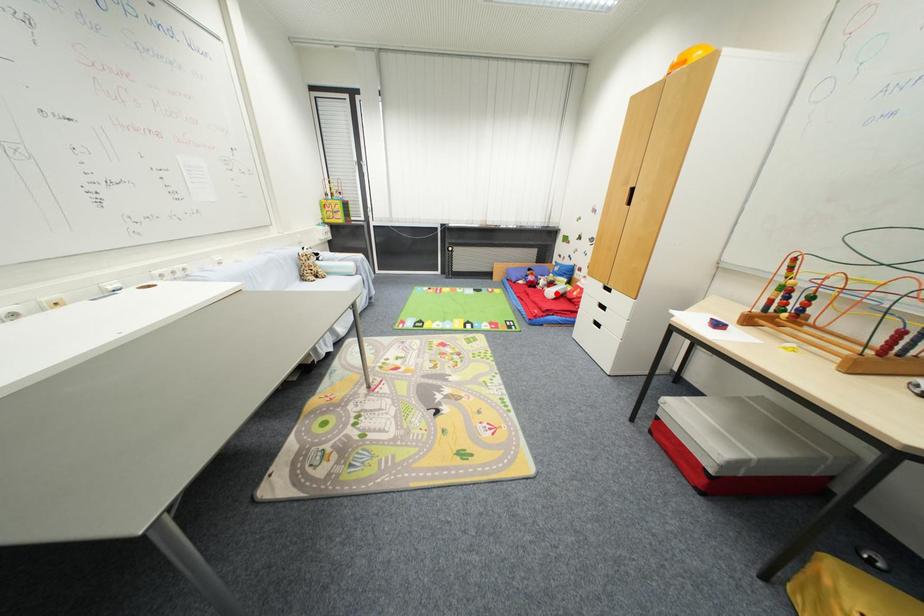
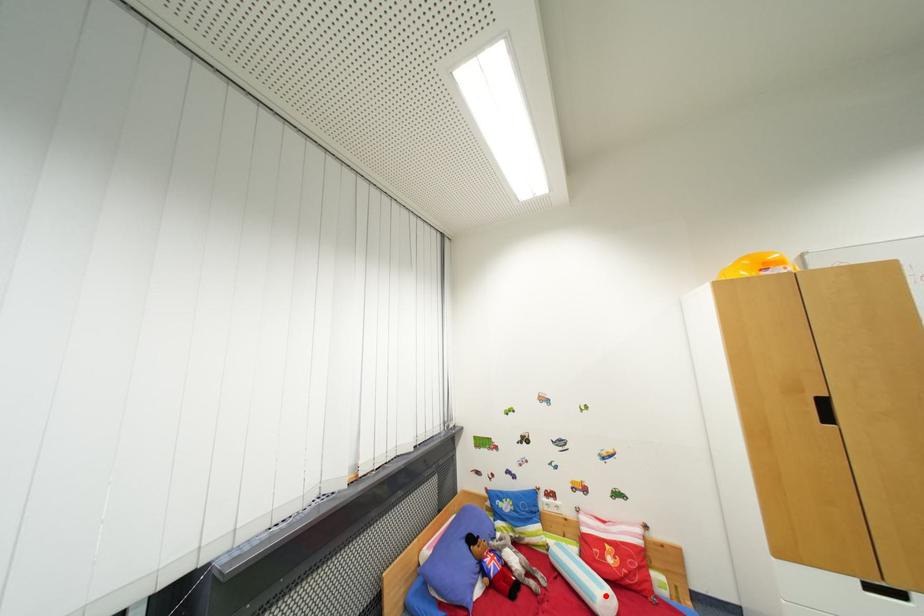
I am providing you with two images of the same scene from different viewpoints. A red point is marked on the first image and another point is marked on the second image. Do the highlighted points in image1 and image2 indicate the same real-world spot?

Yes